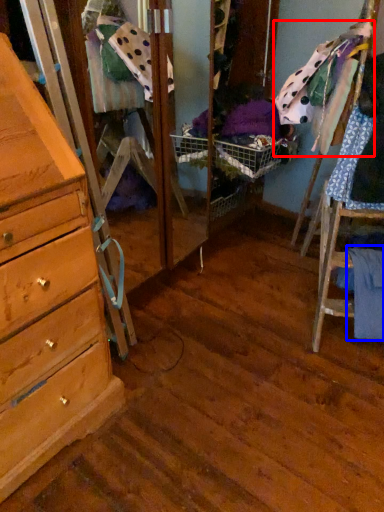
Question: Which object is further to the camera taking this photo, clothing (highlighted by a red box) or clothing (highlighted by a blue box)?

Choices:
 (A) clothing
 (B) clothing

Answer: (B)